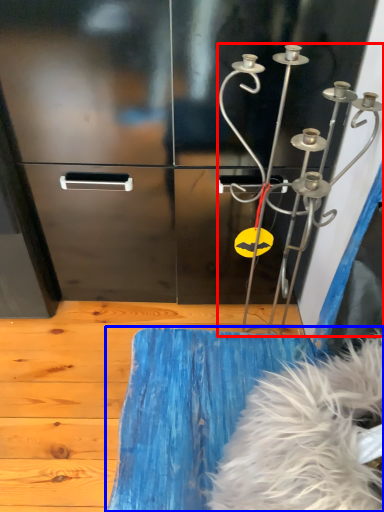
Question: Which point is further to the camera, wind chime (highlighted by a red box) or furniture (highlighted by a blue box)?

Choices:
 (A) wind chime
 (B) furniture

Answer: (A)